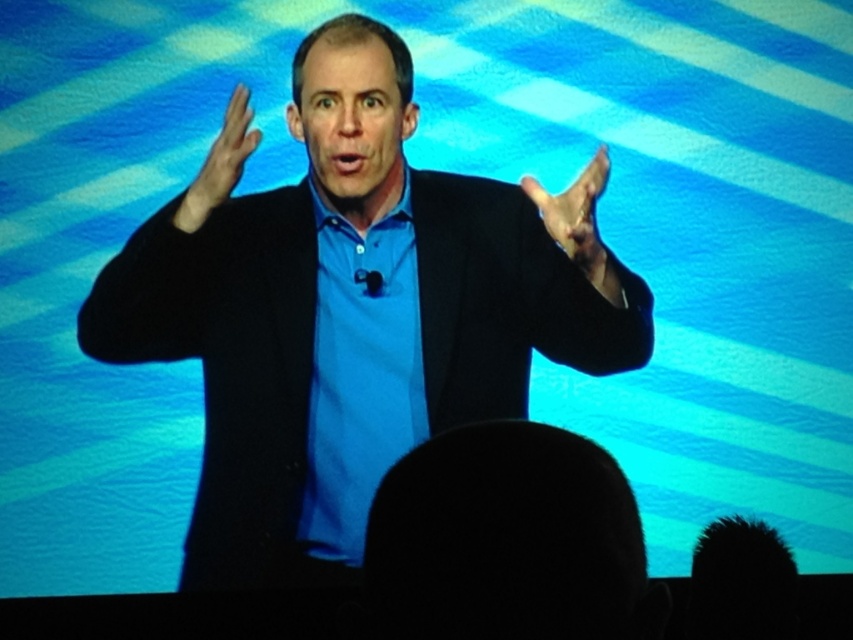
You are a photographer adjusting your camera settings to capture the speaker and the large screen. You notice two points in the image at coordinates point (x=148, y=333) and point (x=548, y=205). Which point should you focus on to ensure the speaker is sharp while keeping the large screen in the background? Explain your reasoning.

You should focus on point (x=148, y=333) because it is closer to the camera than point (x=548, y=205). Since the speaker is the central figure and positioned closer to the camera, focusing on the closer point ensures the speaker remains sharp while the background screen may naturally blur, maintaining the emphasis on the speaker.

You are designing a stage setup for a presentation and need to ensure there is enough space between the two matte black hands. Given that the matte black hand at right and the matte black hand at upper center must be placed on a platform, can you determine if the platform is wide enough if it is 0.5 meters in width?

The matte black hand at right is wider than the matte black hand at upper center, but the platform width of 0.5 meters must accommodate both hands. However, since the description only provides relative size information and not absolute dimensions, we cannot definitively determine if the platform is wide enough based solely on the given data.

You are an event planner organizing a presentation. You need to ensure that the black matte suit at center and the matte black hand at right are visible to the audience. Based on their sizes, which object is more likely to be easily seen from the back of the room?

The black matte suit at center is wider than the matte black hand at right, so it is more likely to be easily seen from the back of the room.